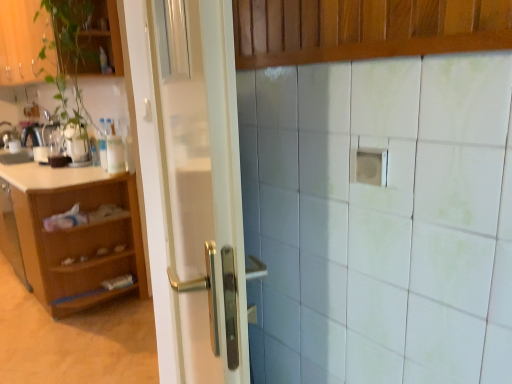
The height and width of the screenshot is (384, 512). Identify the location of light brown wood cabinet at left, the 3th cabinetry in the front-to-back sequence. (71, 234).

This screenshot has height=384, width=512. Find the location of `white glossy door at center`. white glossy door at center is located at coordinates (202, 189).

This screenshot has width=512, height=384. What do you see at coordinates (14, 147) in the screenshot?
I see `white glossy sink at left` at bounding box center [14, 147].

What is the approximate height of green matte plant at upper left, which is the third cabinetry in bottom-to-top order?

green matte plant at upper left, which is the third cabinetry in bottom-to-top order, is 64.12 centimeters tall.

The image size is (512, 384). I want to click on white glossy pot at left, so click(x=77, y=144).

You are a GUI agent. You are given a task and a screenshot of the screen. Output one action in this format:
    pyautogui.click(x=<x>, y=<y>)
    Task: Click on the light brown wood cabinet at left, the 3th cabinetry in the front-to-back sequence
    Image resolution: width=512 pixels, height=384 pixels.
    Given the screenshot: What is the action you would take?
    pyautogui.click(x=71, y=234)

Which is behind, point (97, 226) or point (205, 78)?

Positioned behind is point (97, 226).

Does light brown wood cabinet at left, the 3th cabinetry in the front-to-back sequence, have a smaller size compared to white glossy door at center?

Actually, light brown wood cabinet at left, the 3th cabinetry in the front-to-back sequence, might be larger than white glossy door at center.

The width and height of the screenshot is (512, 384). What are the coordinates of `cabinetry that is the 2nd one when counting leftward from the white glossy door at center` in the screenshot? It's located at (71, 234).

Is light brown wood cabinet at left, the first cabinetry positioned from the back, positioned far away from white glossy door at center?

Yes, light brown wood cabinet at left, the first cabinetry positioned from the back, and white glossy door at center are located far from each other.

Does green matte plant at upper left, acting as the 1th cabinetry starting from the top, have a smaller size compared to white glossy sink at left?

Actually, green matte plant at upper left, acting as the 1th cabinetry starting from the top, might be larger than white glossy sink at left.

Considering the positions of objects green matte plant at upper left, the second cabinetry in the back-to-front sequence, and white glossy sink at left in the image provided, who is more to the right, green matte plant at upper left, the second cabinetry in the back-to-front sequence, or white glossy sink at left?

From the viewer's perspective, green matte plant at upper left, the second cabinetry in the back-to-front sequence, appears more on the right side.

From a real-world perspective, which object stands above the other?

In real-world perspective, white glossy sink at left is above.

Is light brown wood cabinet at left, the first cabinetry positioned from the back, inside the boundaries of white glossy sink at left, or outside?

The correct answer is: outside.

Is the position of light brown wood cabinet at left, the first cabinetry positioned from the back, less distant than that of white glossy sink at left?

Yes, the depth of light brown wood cabinet at left, the first cabinetry positioned from the back, is less than that of white glossy sink at left.

Is light brown wood cabinet at left, the first cabinetry positioned from the back, to the right of white glossy sink at left from the viewer's perspective?

Indeed, light brown wood cabinet at left, the first cabinetry positioned from the back, is positioned on the right side of white glossy sink at left.

From a real-world perspective, who is located lower, white glossy pot at left or green matte plant at upper left, acting as the 1th cabinetry starting from the top?

In real-world perspective, white glossy pot at left is lower.

Between white glossy pot at left and green matte plant at upper left, which is the third cabinetry in bottom-to-top order, which one has smaller width?

Thinner between the two is white glossy pot at left.

Is white glossy pot at left in front of or behind green matte plant at upper left, which is the third cabinetry in bottom-to-top order, in the image?

In the image, white glossy pot at left appears behind green matte plant at upper left, which is the third cabinetry in bottom-to-top order.

Does white glossy pot at left have a smaller size compared to green matte plant at upper left, which is the third cabinetry in bottom-to-top order?

Indeed, white glossy pot at left has a smaller size compared to green matte plant at upper left, which is the third cabinetry in bottom-to-top order.

From a real-world perspective, count 2nd cabinetrys upward from the white glossy door at center and point to it. Please provide its 2D coordinates.

[(23, 42)]

Is white glossy door at center with green matte plant at upper left, the second cabinetry in the back-to-front sequence?

There is a gap between white glossy door at center and green matte plant at upper left, the second cabinetry in the back-to-front sequence.

In the scene shown: Would you say white glossy door at center contains green matte plant at upper left, acting as the 1th cabinetry starting from the top?

No.

Which of these two, white glossy door at center or green matte plant at upper left, acting as the 1th cabinetry starting from the top, is smaller?

white glossy door at center is smaller.

Considering the relative sizes of green matte plant at upper left, which is counted as the second cabinetry, starting from the front, and light brown wood cabinet at left, the first cabinetry positioned from the back, in the image provided, is green matte plant at upper left, which is counted as the second cabinetry, starting from the front, wider than light brown wood cabinet at left, the first cabinetry positioned from the back,?

Incorrect, the width of green matte plant at upper left, which is counted as the second cabinetry, starting from the front, does not surpass that of light brown wood cabinet at left, the first cabinetry positioned from the back.

From a real-world perspective, which object stands above the other?

In real-world perspective, green matte plant at upper left, which is the third cabinetry in bottom-to-top order, is above.

Is light brown wood cabinet at left, the 3th cabinetry in the front-to-back sequence, completely or partially inside green matte plant at upper left, the second cabinetry in the back-to-front sequence?

No.

Is the depth of green matte plant at upper left, the second cabinetry in the back-to-front sequence, greater than that of light brown wood cabinet at left, the 3th cabinetry in the top-to-bottom sequence?

No, green matte plant at upper left, the second cabinetry in the back-to-front sequence, is closer to the viewer.

From the image's perspective, which is above, wooden paneling at upper center, the 3th cabinetry when ordered from back to front, or light brown wood cabinet at left, the first cabinetry when ordered from bottom to top?

wooden paneling at upper center, the 3th cabinetry when ordered from back to front, is shown above in the image.

Is light brown wood cabinet at left, the first cabinetry positioned from the back, at the back of wooden paneling at upper center, positioned as the first cabinetry in front-to-back order?

wooden paneling at upper center, positioned as the first cabinetry in front-to-back order, is not turned away from light brown wood cabinet at left, the first cabinetry positioned from the back.

In the scene shown: In the image, is wooden paneling at upper center, which is counted as the 2th cabinetry, starting from the top, positioned in front of or behind light brown wood cabinet at left, the 3th cabinetry in the front-to-back sequence?

wooden paneling at upper center, which is counted as the 2th cabinetry, starting from the top, is positioned closer to the viewer than light brown wood cabinet at left, the 3th cabinetry in the front-to-back sequence.

In the image, there is a white glossy door at center. Identify the location of cabinetry below it (from a real-world perspective). (71, 234).

Locate an element on the screen. sink behind the green matte plant at upper left, the second cabinetry in the back-to-front sequence is located at coordinates (14, 147).

Looking at the image, which one is located further to light brown wood cabinet at left, the 3th cabinetry in the front-to-back sequence, white glossy sink at left or white glossy pot at left?

white glossy sink at left is positioned further to the anchor light brown wood cabinet at left, the 3th cabinetry in the front-to-back sequence.

Looking at the image, which one is located further to white glossy sink at left, green matte plant at upper left, the second cabinetry in the back-to-front sequence, or white glossy pot at left?

Among the two, green matte plant at upper left, the second cabinetry in the back-to-front sequence, is located further to white glossy sink at left.

Consider the image. Estimate the real-world distances between objects in this image. Which object is closer to white glossy pot at left, green matte plant at upper left, which is the third cabinetry in bottom-to-top order, or light brown wood cabinet at left, the 3th cabinetry in the top-to-bottom sequence?

Based on the image, light brown wood cabinet at left, the 3th cabinetry in the top-to-bottom sequence, appears to be nearer to white glossy pot at left.

When comparing their distances from green glossy plant at upper left, does white glossy door at center or light brown wood cabinet at left, the first cabinetry positioned from the back, seem closer?

light brown wood cabinet at left, the first cabinetry positioned from the back.

Estimate the real-world distances between objects in this image. Which object is closer to green glossy plant at upper left, white glossy pot at left or green matte plant at upper left, the second cabinetry in the back-to-front sequence?

Among the two, green matte plant at upper left, the second cabinetry in the back-to-front sequence, is located nearer to green glossy plant at upper left.

Estimate the real-world distances between objects in this image. Which object is further from green matte plant at upper left, acting as the 1th cabinetry starting from the top, white glossy door at center or green glossy plant at upper left?

Among the two, white glossy door at center is located further to green matte plant at upper left, acting as the 1th cabinetry starting from the top.

Considering their positions, is green glossy plant at upper left positioned further to wooden paneling at upper center, positioned as the first cabinetry in front-to-back order, than white glossy sink at left?

The object further to wooden paneling at upper center, positioned as the first cabinetry in front-to-back order, is white glossy sink at left.

Looking at the image, which one is located further to light brown wood cabinet at left, the first cabinetry when ordered from bottom to top, white glossy sink at left or wooden paneling at upper center, the 3th cabinetry when ordered from back to front?

wooden paneling at upper center, the 3th cabinetry when ordered from back to front, is positioned further to the anchor light brown wood cabinet at left, the first cabinetry when ordered from bottom to top.

I want to click on plant between green matte plant at upper left, acting as the 1th cabinetry starting from the top, and white glossy sink at left from front to back, so click(69, 55).

Locate an element on the screen. This screenshot has width=512, height=384. appliance between wooden paneling at upper center, positioned as the first cabinetry in front-to-back order, and white glossy sink at left from front to back is located at coordinates (77, 144).

You are a GUI agent. You are given a task and a screenshot of the screen. Output one action in this format:
    pyautogui.click(x=<x>, y=<y>)
    Task: Click on the plant between green matte plant at upper left, acting as the 1th cabinetry starting from the top, and white glossy pot at left from front to back
    
    Given the screenshot: What is the action you would take?
    pyautogui.click(x=69, y=55)

Find the location of a particular element. appliance located between green glossy plant at upper left and white glossy sink at left in the depth direction is located at coordinates (77, 144).